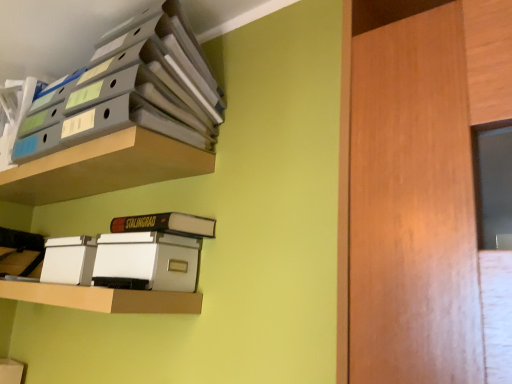
Question: Looking at the image, does matte plastic shelf at upper left, which ranks as the second shelf in bottom-to-top order, seem bigger or smaller compared to white plastic storage box at lower left?

Choices:
 (A) big
 (B) small

Answer: (A)

Question: From the image's perspective, relative to white plastic storage box at lower left, is matte plastic shelf at upper left, which ranks as the second shelf in bottom-to-top order, above or below?

Choices:
 (A) above
 (B) below

Answer: (A)

Question: Considering the real-world distances, which object is closest to the matte plastic shelf at upper left, which ranks as the second shelf in bottom-to-top order?

Choices:
 (A) matte gray folders at upper left, the third shelf from the bottom
 (B) white cardboard shelf at lower center, marked as the 1th shelf in a bottom-to-top arrangement
 (C) hardcover book at center
 (D) white plastic storage box at lower left

Answer: (A)

Question: Which is nearer to the matte gray folders at upper left, the third shelf from the bottom?

Choices:
 (A) hardcover book at center
 (B) matte plastic shelf at upper left, which ranks as the second shelf in bottom-to-top order
 (C) white plastic storage box at lower left
 (D) white cardboard shelf at lower center, marked as the 1th shelf in a bottom-to-top arrangement

Answer: (B)